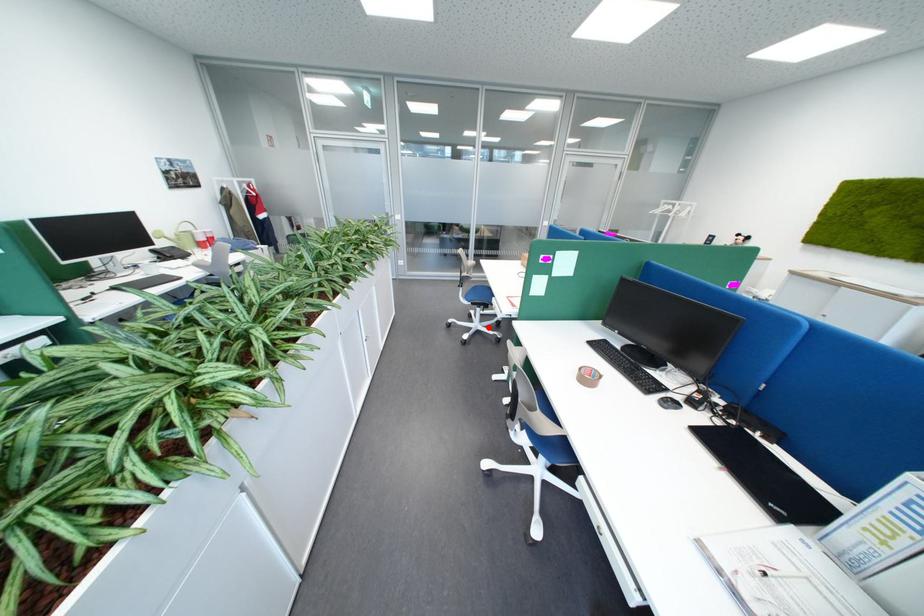
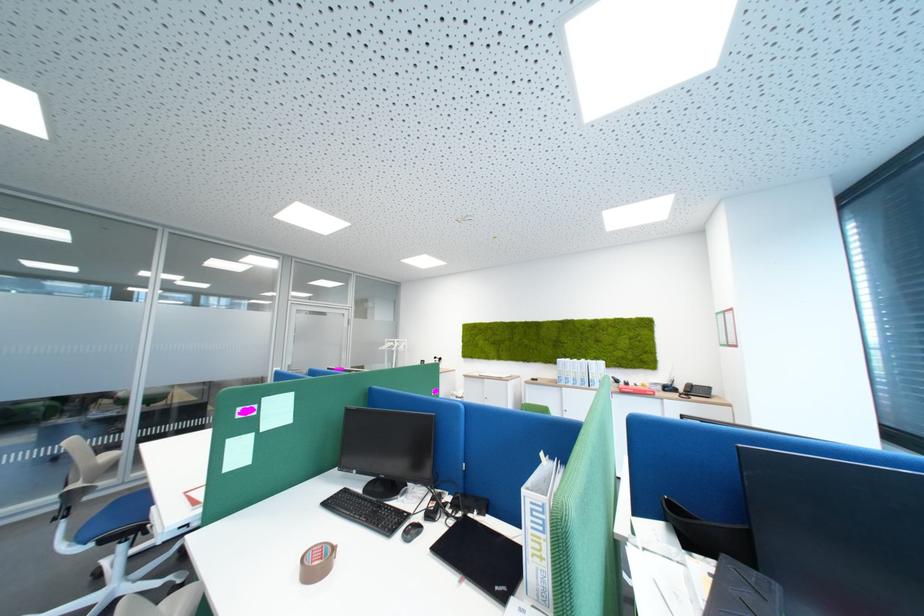
Where in the second image is the point corresponding to the highlighted location from the first image?

(124, 594)